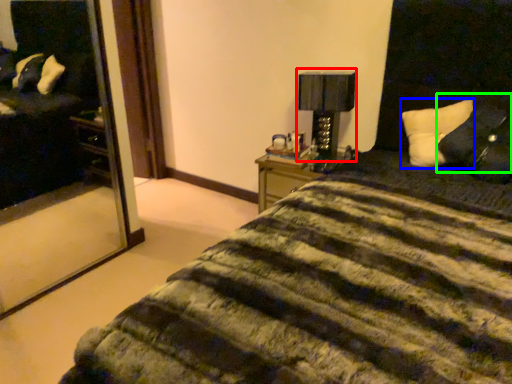
Question: Based on their relative distances, which object is nearer to table lamp (highlighted by a red box)? Choose from pillow (highlighted by a blue box) and pillow (highlighted by a green box).

Choices:
 (A) pillow
 (B) pillow

Answer: (A)